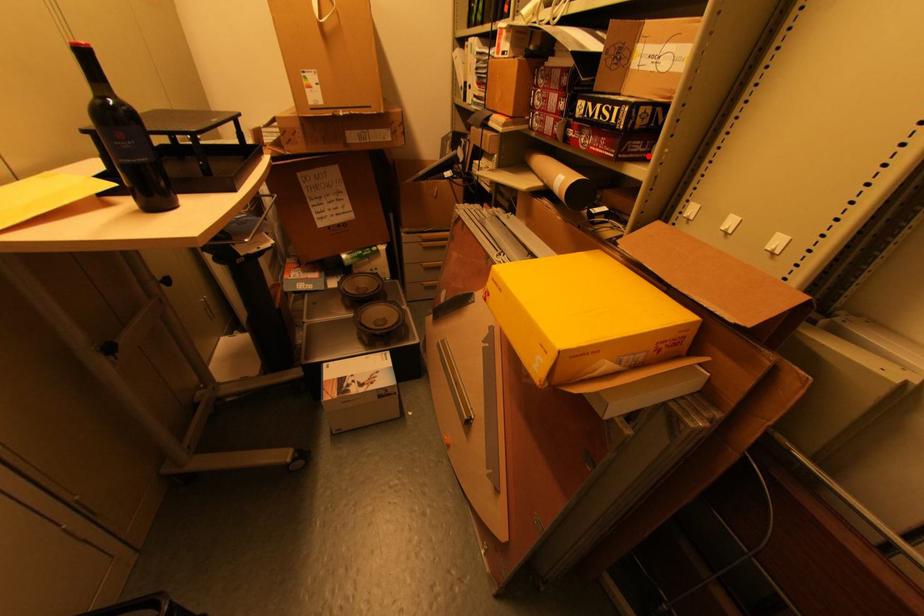
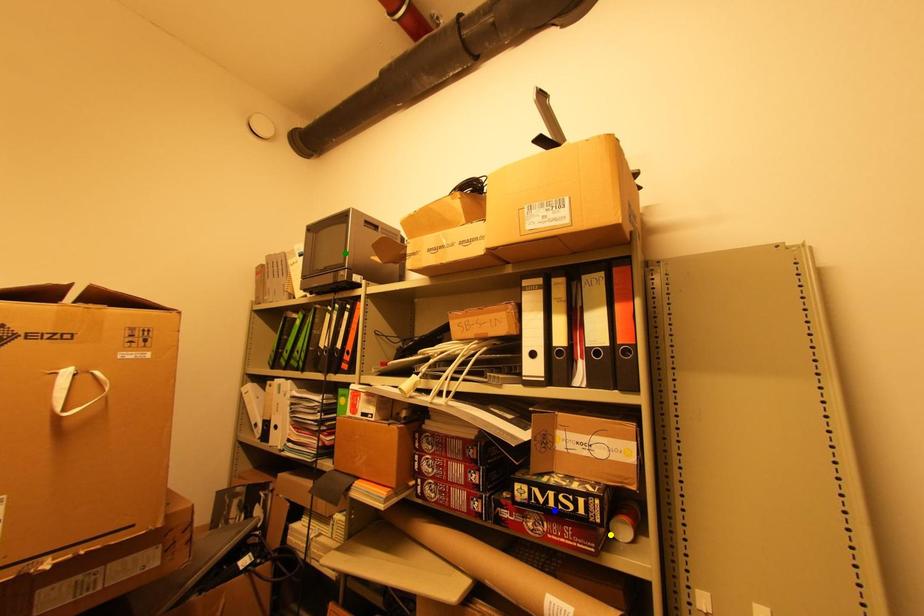
Question: I am providing you with two images of the same scene from different viewpoints. A red point is marked on the first image. You are given multiple points on the second image. Which spot in image 2 lines up with the point in image 1?

Choices:
 (A) green point
 (B) blue point
 (C) yellow point

Answer: (C)